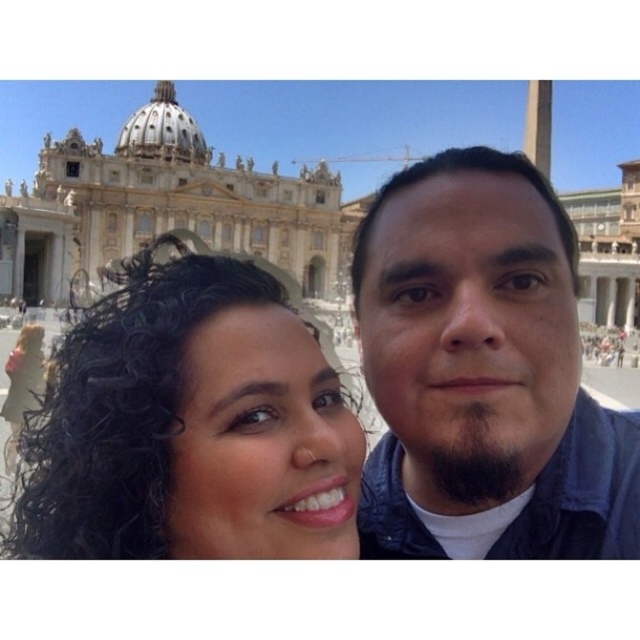
Question: Can you confirm if matte blue jacket at center is smaller than dark blue jacket at center?

Choices:
 (A) yes
 (B) no

Answer: (B)

Question: Which object is the closest to the dark curly hair at center?

Choices:
 (A) dark blue jacket at center
 (B) matte blue jacket at center

Answer: (B)

Question: In this image, where is dark blue jacket at center located relative to dark curly hair at center?

Choices:
 (A) above
 (B) below

Answer: (B)

Question: Does dark blue jacket at center come behind dark curly hair at center?

Choices:
 (A) yes
 (B) no

Answer: (A)

Question: Which point is closer to the camera?

Choices:
 (A) dark curly hair at center
 (B) dark blue jacket at center

Answer: (A)

Question: Which object is the closest to the dark blue jacket at center?

Choices:
 (A) dark curly hair at center
 (B) matte blue jacket at center

Answer: (B)